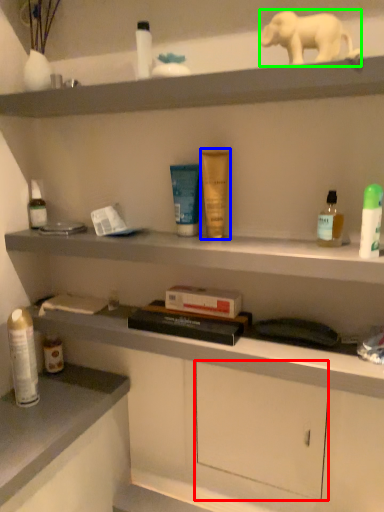
Question: Which is farther away from drawer (highlighted by a red box)? toiletry (highlighted by a blue box) or elephant (highlighted by a green box)?

Choices:
 (A) toiletry
 (B) elephant

Answer: (B)